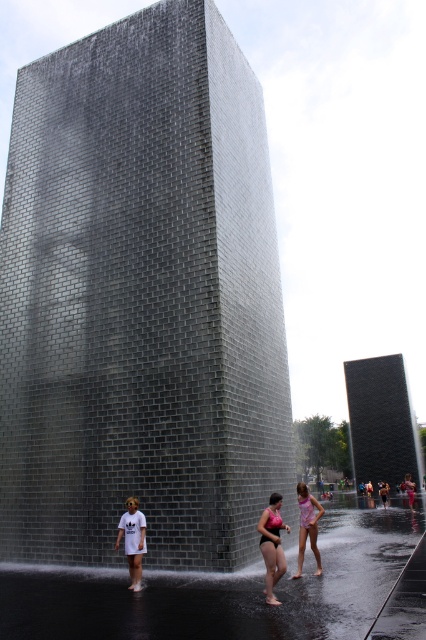
Which of these two, white matte t-shirt at lower center or pink fabric swimsuit at lower center, stands shorter?

Standing shorter between the two is white matte t-shirt at lower center.

Who is more forward, (132, 508) or (296, 490)?

Positioned in front is point (132, 508).

The image size is (426, 640). I want to click on white matte t-shirt at lower center, so click(132, 540).

The image size is (426, 640). I want to click on white matte t-shirt at lower center, so click(x=132, y=540).

You are a GUI agent. You are given a task and a screenshot of the screen. Output one action in this format:
    pyautogui.click(x=<x>, y=<y>)
    Task: Click on the clear water at lower center
    The image size is (426, 640).
    Given the screenshot: What is the action you would take?
    pyautogui.click(x=224, y=589)

Is point (362, 602) farther from viewer compared to point (305, 506)?

No.

Who is more distant from viewer, (388, 544) or (308, 531)?

Positioned behind is point (388, 544).

I want to click on clear water at lower center, so click(224, 589).

Does clear water at lower center have a greater height compared to pink matte swimsuit at center?

Yes.

Between clear water at lower center and pink matte swimsuit at center, which one has less height?

pink matte swimsuit at center

The width and height of the screenshot is (426, 640). What are the coordinates of `clear water at lower center` in the screenshot? It's located at (224, 589).